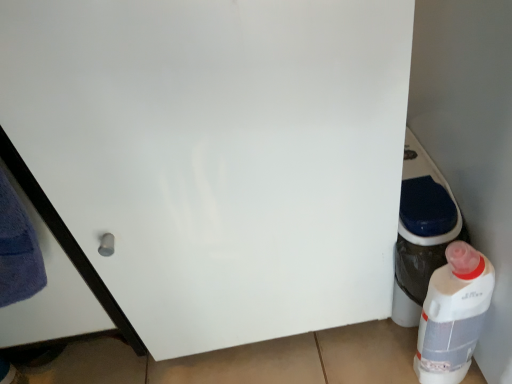
What is the approximate width of white plastic bottle at lower right?

white plastic bottle at lower right is 5.19 inches wide.

The width and height of the screenshot is (512, 384). What do you see at coordinates (453, 314) in the screenshot? I see `white plastic bottle at lower right` at bounding box center [453, 314].

The width and height of the screenshot is (512, 384). What are the coordinates of `white plastic bottle at lower right` in the screenshot? It's located at (453, 314).

Find the location of a particular element. The image size is (512, 384). white plastic bottle at lower right is located at coordinates (453, 314).